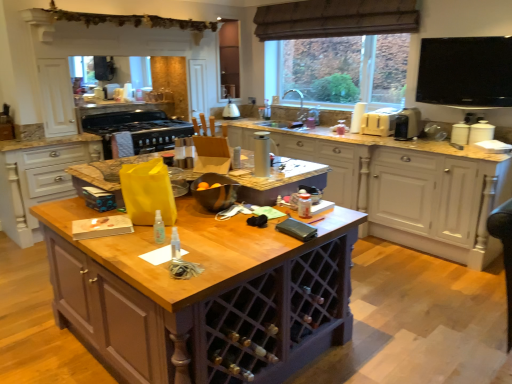
The height and width of the screenshot is (384, 512). What are the coordinates of `free spot to the right of silver metallic thermos at center, arranged as the 2th appliance when viewed from the front` in the screenshot? It's located at (285, 173).